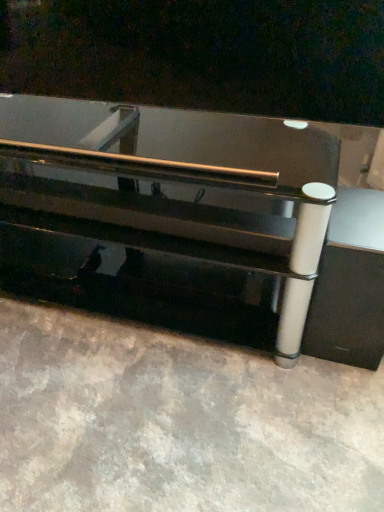
This screenshot has width=384, height=512. I want to click on glossy black table at center, so click(x=180, y=184).

The width and height of the screenshot is (384, 512). Describe the element at coordinates (180, 184) in the screenshot. I see `glossy black table at center` at that location.

At what (x,y) coordinates should I click in order to perform the action: click on glossy black table at center. Please return your answer as a coordinate pair (x, y). The image size is (384, 512). Looking at the image, I should click on pyautogui.click(x=180, y=184).